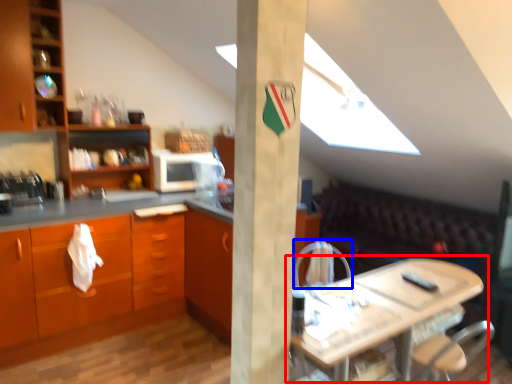
Question: Which of the following is the closest to the observer, table (highlighted by a red box) or armchair (highlighted by a blue box)?

Choices:
 (A) table
 (B) armchair

Answer: (A)